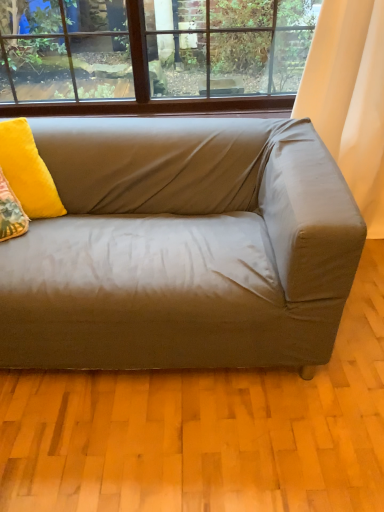
Identify the location of white fabric curtain at right. The height and width of the screenshot is (512, 384). (350, 98).

How many degrees apart are the facing directions of velvet yellow pillow at upper left and white fabric curtain at right?

The angle between the facing direction of velvet yellow pillow at upper left and the facing direction of white fabric curtain at right is 25.5 degrees.

Consider the image. From a real-world perspective, relative to white fabric curtain at right, is velvet yellow pillow at upper left vertically above or below?

From a real-world perspective, velvet yellow pillow at upper left is physically above white fabric curtain at right.

Visually, is velvet yellow pillow at upper left positioned to the left or to the right of white fabric curtain at right?

Based on their positions, velvet yellow pillow at upper left is located to the left of white fabric curtain at right.

Does velvet yellow pillow at upper left lie behind white fabric curtain at right?

No, velvet yellow pillow at upper left is closer to the viewer.

From a real-world perspective, is white fabric curtain at right above or below satin beige couch at center?

Clearly, from a real-world perspective, white fabric curtain at right is above satin beige couch at center.

Considering the positions of objects white fabric curtain at right and satin beige couch at center in the image provided, who is more to the right, white fabric curtain at right or satin beige couch at center?

From the viewer's perspective, white fabric curtain at right appears more on the right side.

From the image's perspective, between white fabric curtain at right and satin beige couch at center, who is located below?

satin beige couch at center appears lower in the image.

Is velvet yellow pillow at upper left not close to satin beige couch at center?

They are positioned close to each other.

From a real-world perspective, who is located lower, velvet yellow pillow at upper left or satin beige couch at center?

satin beige couch at center.

Who is shorter, velvet yellow pillow at upper left or satin beige couch at center?

velvet yellow pillow at upper left.

Does point (383, 34) lie in front of point (26, 176)?

That is False.

What's the angular difference between white fabric curtain at right and velvet yellow pillow at upper left's facing directions?

There is a 25.5-degree angle between the facing directions of white fabric curtain at right and velvet yellow pillow at upper left.

Is white fabric curtain at right to the left of velvet yellow pillow at upper left from the viewer's perspective?

No, white fabric curtain at right is not to the left of velvet yellow pillow at upper left.

Based on the photo, from the image's perspective, relative to velvet yellow pillow at upper left, is white fabric curtain at right above or below?

From the image's perspective, white fabric curtain at right appears above velvet yellow pillow at upper left.

What's the angular difference between satin beige couch at center and white fabric curtain at right's facing directions?

1.89 degrees.

Between satin beige couch at center and white fabric curtain at right, which one has smaller width?

white fabric curtain at right.

Is satin beige couch at center touching white fabric curtain at right?

satin beige couch at center and white fabric curtain at right are not in contact.

From the image's perspective, is satin beige couch at center on top of white fabric curtain at right?

Incorrect, from the image's perspective, satin beige couch at center is lower than white fabric curtain at right.

Would you say velvet yellow pillow at upper left is part of satin beige couch at center's contents?

Yes, velvet yellow pillow at upper left is a part of satin beige couch at center.

Would you consider satin beige couch at center to be distant from velvet yellow pillow at upper left?

satin beige couch at center is actually quite close to velvet yellow pillow at upper left.

Considering the sizes of objects satin beige couch at center and velvet yellow pillow at upper left in the image provided, who is bigger, satin beige couch at center or velvet yellow pillow at upper left?

With larger size is satin beige couch at center.

Image resolution: width=384 pixels, height=512 pixels. Identify the location of curtain on the right of the velvet yellow pillow at upper left. click(350, 98).

In the image, there is a white fabric curtain at right. Where is `studio couch below it (from the image's perspective)`? This screenshot has height=512, width=384. studio couch below it (from the image's perspective) is located at coordinates (181, 247).

Looking at the image, which one is located further to satin beige couch at center, velvet yellow pillow at upper left or white fabric curtain at right?

white fabric curtain at right is further to satin beige couch at center.

From the image, which object appears to be nearer to white fabric curtain at right, velvet yellow pillow at upper left or satin beige couch at center?

satin beige couch at center is closer to white fabric curtain at right.

Based on the photo, considering their positions, is satin beige couch at center positioned closer to velvet yellow pillow at upper left than white fabric curtain at right?

satin beige couch at center lies closer to velvet yellow pillow at upper left than the other object.

Estimate the real-world distances between objects in this image. Which object is further from white fabric curtain at right, satin beige couch at center or velvet yellow pillow at upper left?

Based on the image, velvet yellow pillow at upper left appears to be further to white fabric curtain at right.

From the image, which object appears to be nearer to satin beige couch at center, white fabric curtain at right or velvet yellow pillow at upper left?

velvet yellow pillow at upper left lies closer to satin beige couch at center than the other object.

Looking at the image, which one is located closer to velvet yellow pillow at upper left, white fabric curtain at right or satin beige couch at center?

Among the two, satin beige couch at center is located nearer to velvet yellow pillow at upper left.

Where is `studio couch located between velvet yellow pillow at upper left and white fabric curtain at right in the left-right direction`? studio couch located between velvet yellow pillow at upper left and white fabric curtain at right in the left-right direction is located at coordinates (x=181, y=247).